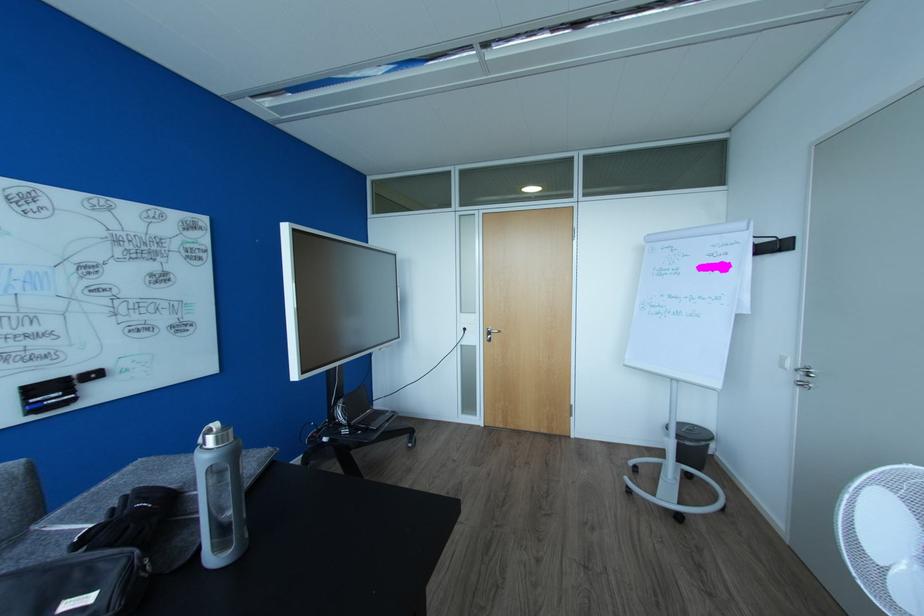
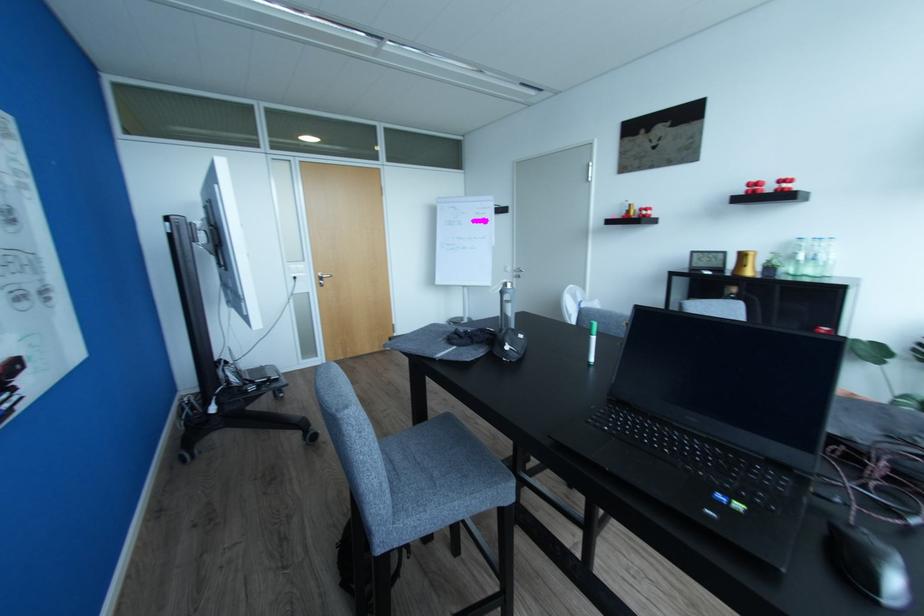
Find the pixel in the second image that matches [493,333] in the first image.

(324, 278)